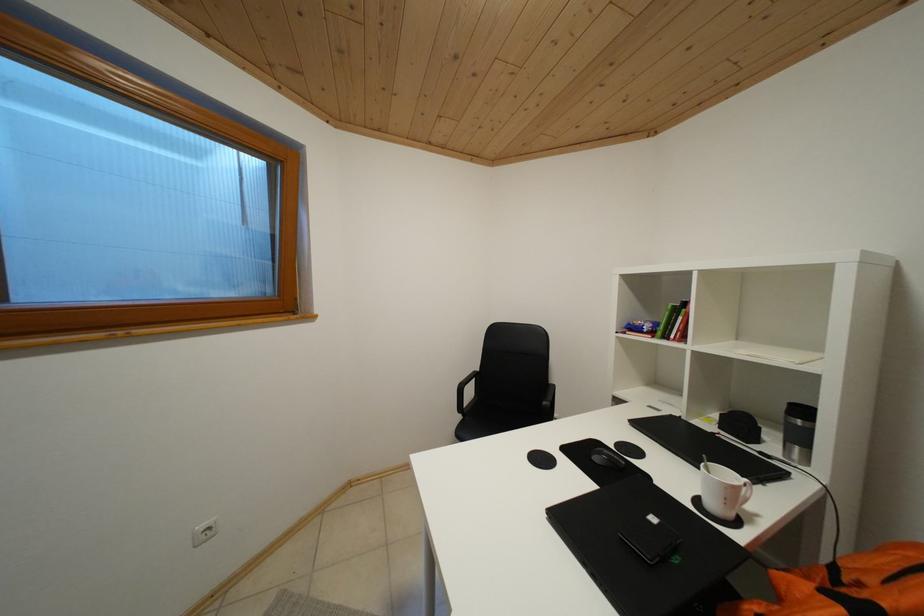
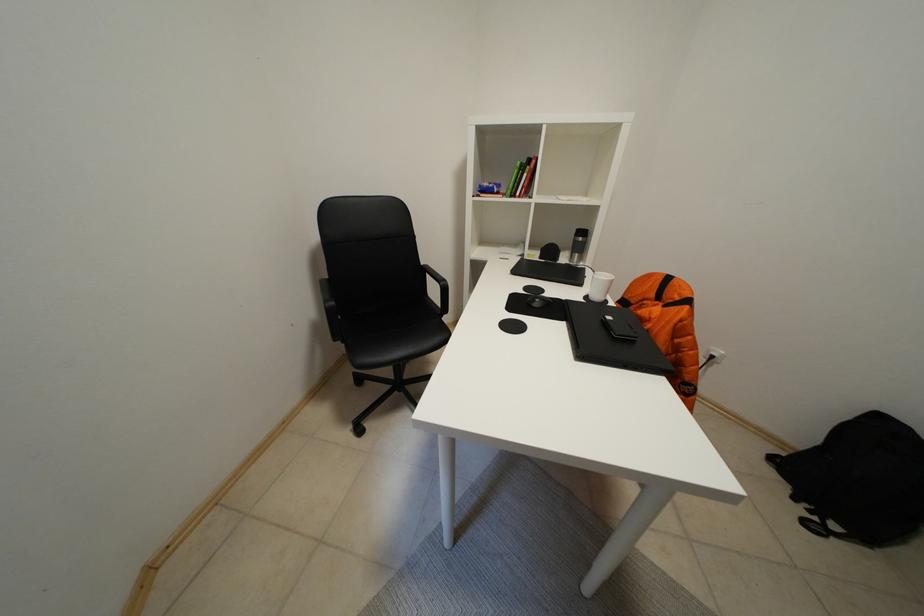
The images are taken continuously from a first-person perspective. In which direction is your viewpoint rotating?

The camera rotated toward right-down.